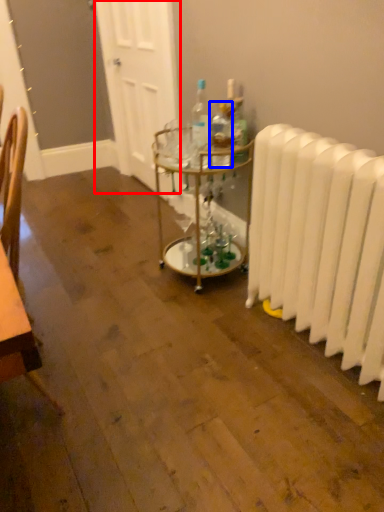
Question: Which object is further to the camera taking this photo, door (highlighted by a red box) or bottle (highlighted by a blue box)?

Choices:
 (A) door
 (B) bottle

Answer: (A)